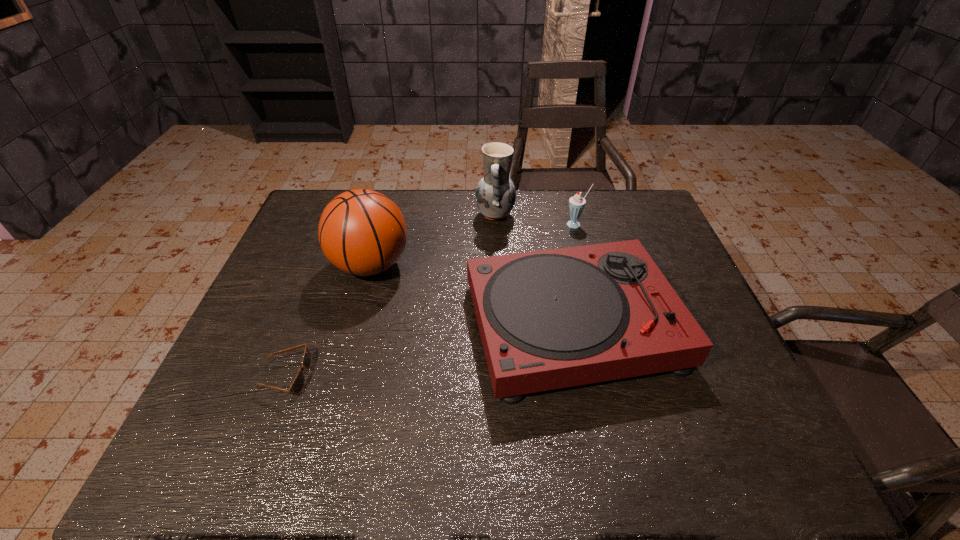
Image resolution: width=960 pixels, height=540 pixels. In order to click on vacant point at the right edge in this screenshot , I will do `click(676, 381)`.

Where is `free space at the far left corner of the desktop`? Image resolution: width=960 pixels, height=540 pixels. free space at the far left corner of the desktop is located at coordinates pyautogui.click(x=328, y=199).

Locate an element on the screen. The height and width of the screenshot is (540, 960). vacant area at the far right corner is located at coordinates (630, 198).

Locate an element on the screen. free space between the record player and the shortest object is located at coordinates (429, 350).

The image size is (960, 540). Find the location of `empty location between the basketball and the sunglasses`. empty location between the basketball and the sunglasses is located at coordinates (328, 321).

Image resolution: width=960 pixels, height=540 pixels. Find the location of `free space that is in between the milkshake and the pottery`. free space that is in between the milkshake and the pottery is located at coordinates (536, 220).

This screenshot has width=960, height=540. I want to click on vacant point located between the pottery and the milkshake, so click(536, 220).

Where is `blank region between the pottery and the shortest object`? This screenshot has width=960, height=540. blank region between the pottery and the shortest object is located at coordinates (390, 295).

Image resolution: width=960 pixels, height=540 pixels. Identify the location of free area in between the pottery and the milkshake. (536, 220).

Where is `free area in between the basketball and the milkshake`? The width and height of the screenshot is (960, 540). free area in between the basketball and the milkshake is located at coordinates (473, 245).